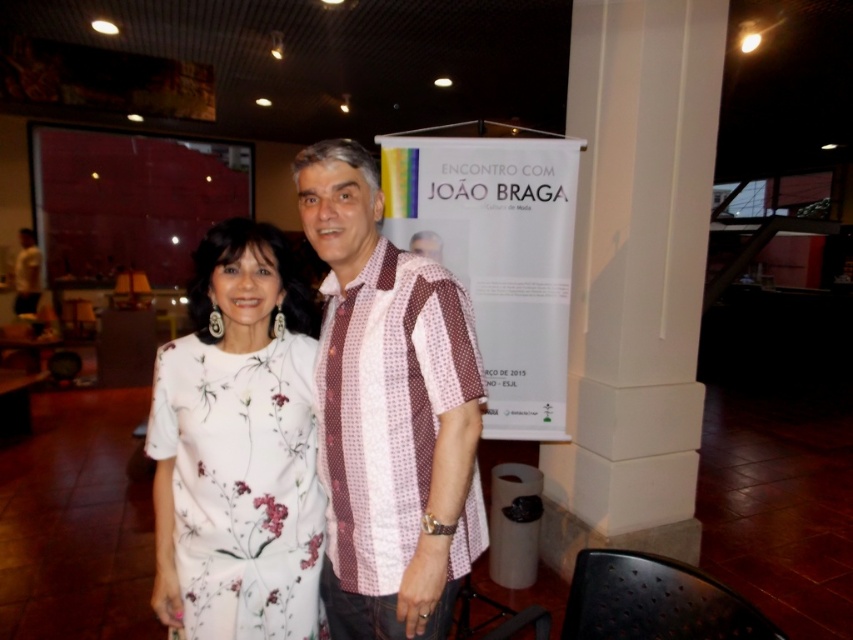
Who is lower down, patterned fabric shirt at center or white floral dress at center?

white floral dress at center

Who is positioned more to the left, patterned fabric shirt at center or white floral dress at center?

Positioned to the left is white floral dress at center.

Identify the location of patterned fabric shirt at center. The height and width of the screenshot is (640, 853). (389, 412).

Is white smooth pillar at center taller than white floral dress at center?

Correct, white smooth pillar at center is much taller as white floral dress at center.

Who is higher up, white smooth pillar at center or white floral dress at center?

white smooth pillar at center is higher up.

Does point (674, 237) come in front of point (158, 477)?

That is False.

You are a GUI agent. You are given a task and a screenshot of the screen. Output one action in this format:
    pyautogui.click(x=<x>, y=<y>)
    Task: Click on the white smooth pillar at center
    
    Given the screenshot: What is the action you would take?
    pyautogui.click(x=635, y=276)

Is white smooth pillar at center thinner than patterned fabric shirt at center?

No.

Does white smooth pillar at center have a lesser height compared to patterned fabric shirt at center?

No.

At what (x,y) coordinates should I click in order to perform the action: click on white smooth pillar at center. Please return your answer as a coordinate pair (x, y). The width and height of the screenshot is (853, 640). Looking at the image, I should click on (635, 276).

Identify the location of white smooth pillar at center. The height and width of the screenshot is (640, 853). (635, 276).